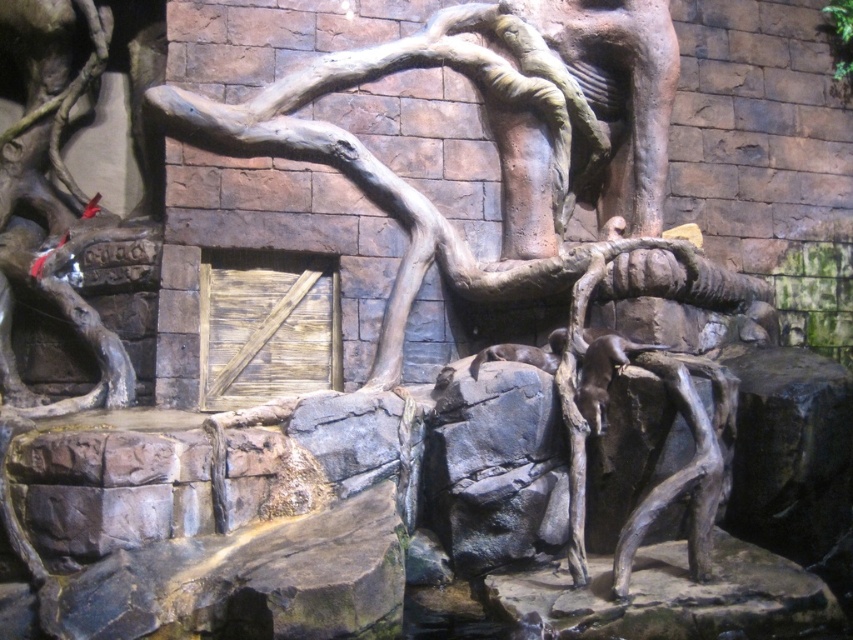
Question: Which object is positioned farthest from the rustic wood tree trunk at center?

Choices:
 (A) brown furry otter at center
 (B) brown furry otter at center-right

Answer: (B)

Question: Among these objects, which one is farthest from the camera?

Choices:
 (A) brown furry otter at center
 (B) rustic wood tree trunk at center

Answer: (B)

Question: Does brown furry otter at center-right appear over brown furry otter at center?

Choices:
 (A) no
 (B) yes

Answer: (A)

Question: Which object is farther from the camera taking this photo?

Choices:
 (A) brown furry otter at center-right
 (B) rustic wood tree trunk at center
 (C) brown furry otter at center

Answer: (B)

Question: Can you confirm if rustic wood tree trunk at center is bigger than brown furry otter at center-right?

Choices:
 (A) yes
 (B) no

Answer: (A)

Question: Can you confirm if rustic wood tree trunk at center is wider than brown furry otter at center-right?

Choices:
 (A) yes
 (B) no

Answer: (A)